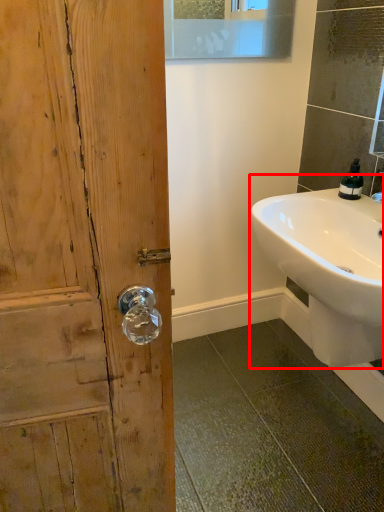
Question: Observing the image, what is the correct spatial positioning of sink (annotated by the red box) in reference to soap dispenser?

Choices:
 (A) right
 (B) left

Answer: (B)